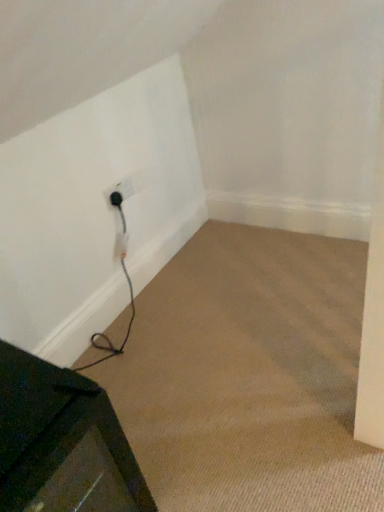
You are a GUI agent. You are given a task and a screenshot of the screen. Output one action in this format:
    pyautogui.click(x=<x>, y=<y>)
    Task: Click on the black plastic outlet at lower left
    This screenshot has width=384, height=512.
    Given the screenshot: What is the action you would take?
    pyautogui.click(x=119, y=192)

Who is more distant, black rubber plug at lower left or metallic dark green table at lower left?

black rubber plug at lower left.

In terms of size, does black rubber plug at lower left appear bigger or smaller than metallic dark green table at lower left?

Considering their sizes, black rubber plug at lower left takes up less space than metallic dark green table at lower left.

Considering the relative positions of black rubber plug at lower left and metallic dark green table at lower left in the image provided, is black rubber plug at lower left to the right of metallic dark green table at lower left from the viewer's perspective?

Yes.

From the image's perspective, would you say black rubber plug at lower left is positioned over metallic dark green table at lower left?

Yes, from the image's perspective, black rubber plug at lower left is over metallic dark green table at lower left.

Which is closer, (x=78, y=454) or (x=123, y=194)?

Positioned in front is point (x=78, y=454).

The width and height of the screenshot is (384, 512). Identify the location of furniture that is in front of the black plastic outlet at lower left. (62, 443).

In the image, is metallic dark green table at lower left on the left side or the right side of black plastic outlet at lower left?

metallic dark green table at lower left is positioned on black plastic outlet at lower left's left side.

Consider the image. Choose the correct answer: Is metallic dark green table at lower left inside black plastic outlet at lower left or outside it?

metallic dark green table at lower left is outside black plastic outlet at lower left.

Is metallic dark green table at lower left looking in the opposite direction of black rubber plug at lower left?

That's not correct — metallic dark green table at lower left is not looking away from black rubber plug at lower left.

In the image, is metallic dark green table at lower left on the left side or the right side of black rubber plug at lower left?

From the image, it's evident that metallic dark green table at lower left is to the left of black rubber plug at lower left.

Find the location of `furniture on the left of the black rubber plug at lower left`. furniture on the left of the black rubber plug at lower left is located at coordinates (62, 443).

Is metallic dark green table at lower left further to the viewer compared to black rubber plug at lower left?

No, it is not.

Considering the sizes of black plastic outlet at lower left and metallic dark green table at lower left in the image, is black plastic outlet at lower left taller or shorter than metallic dark green table at lower left?

black plastic outlet at lower left is shorter than metallic dark green table at lower left.

From a real-world perspective, relative to metallic dark green table at lower left, is black plastic outlet at lower left vertically above or below?

In terms of real-world spatial position, black plastic outlet at lower left is above metallic dark green table at lower left.

From the image's perspective, relative to metallic dark green table at lower left, is black plastic outlet at lower left above or below?

Based on their image positions, black plastic outlet at lower left is located above metallic dark green table at lower left.

In terms of size, does black plastic outlet at lower left appear bigger or smaller than black rubber plug at lower left?

In the image, black plastic outlet at lower left appears to be larger than black rubber plug at lower left.

Is black plastic outlet at lower left beside black rubber plug at lower left?

Yes, black plastic outlet at lower left is right next to black rubber plug at lower left and making contact.

Is black plastic outlet at lower left facing towards black rubber plug at lower left?

Yes.

How many degrees apart are the facing directions of black plastic outlet at lower left and black rubber plug at lower left?

The facing directions of black plastic outlet at lower left and black rubber plug at lower left are 0.0034 degrees apart.

Considering the relative positions of black rubber plug at lower left and black plastic outlet at lower left in the image provided, is black rubber plug at lower left behind black plastic outlet at lower left?

Yes, black rubber plug at lower left is further from the camera.

Is black rubber plug at lower left located outside black plastic outlet at lower left?

No, most part of black rubber plug at lower left lies within black plastic outlet at lower left.

From the image's perspective, is black rubber plug at lower left positioned above or below black plastic outlet at lower left?

Based on their image positions, black rubber plug at lower left is located above black plastic outlet at lower left.

In terms of height, does black rubber plug at lower left look taller or shorter compared to black plastic outlet at lower left?

Considering their sizes, black rubber plug at lower left has less height than black plastic outlet at lower left.

Find the location of a particular element. The image size is (384, 512). plug above the metallic dark green table at lower left (from the image's perspective) is located at coordinates pyautogui.click(x=116, y=199).

The height and width of the screenshot is (512, 384). In order to click on electric outlet above the metallic dark green table at lower left (from a real-world perspective) in this screenshot , I will do `click(119, 192)`.

Considering their positions, is metallic dark green table at lower left positioned further to black plastic outlet at lower left than black rubber plug at lower left?

metallic dark green table at lower left.

Looking at this image, when comparing their distances from metallic dark green table at lower left, does black plastic outlet at lower left or black rubber plug at lower left seem closer?

Based on the image, black plastic outlet at lower left appears to be nearer to metallic dark green table at lower left.

From the image, which object appears to be farther from metallic dark green table at lower left, black rubber plug at lower left or black plastic outlet at lower left?

Based on the image, black rubber plug at lower left appears to be further to metallic dark green table at lower left.

From the image, which object appears to be farther from black rubber plug at lower left, metallic dark green table at lower left or black plastic outlet at lower left?

metallic dark green table at lower left is positioned further to the anchor black rubber plug at lower left.

Considering their positions, is black plastic outlet at lower left positioned closer to black rubber plug at lower left than metallic dark green table at lower left?

Among the two, black plastic outlet at lower left is located nearer to black rubber plug at lower left.

Based on their spatial positions, is black rubber plug at lower left or metallic dark green table at lower left closer to black plastic outlet at lower left?

Based on the image, black rubber plug at lower left appears to be nearer to black plastic outlet at lower left.

This screenshot has width=384, height=512. Find the location of `electric outlet between metallic dark green table at lower left and black rubber plug at lower left in the front-back direction`. electric outlet between metallic dark green table at lower left and black rubber plug at lower left in the front-back direction is located at coordinates (119, 192).